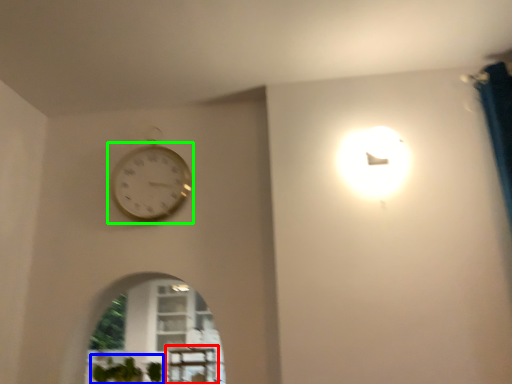
Question: Which object is the farthest from table (highlighted by a red box)? Choose among these: plant (highlighted by a blue box) or wall clock (highlighted by a green box).

Choices:
 (A) plant
 (B) wall clock

Answer: (B)